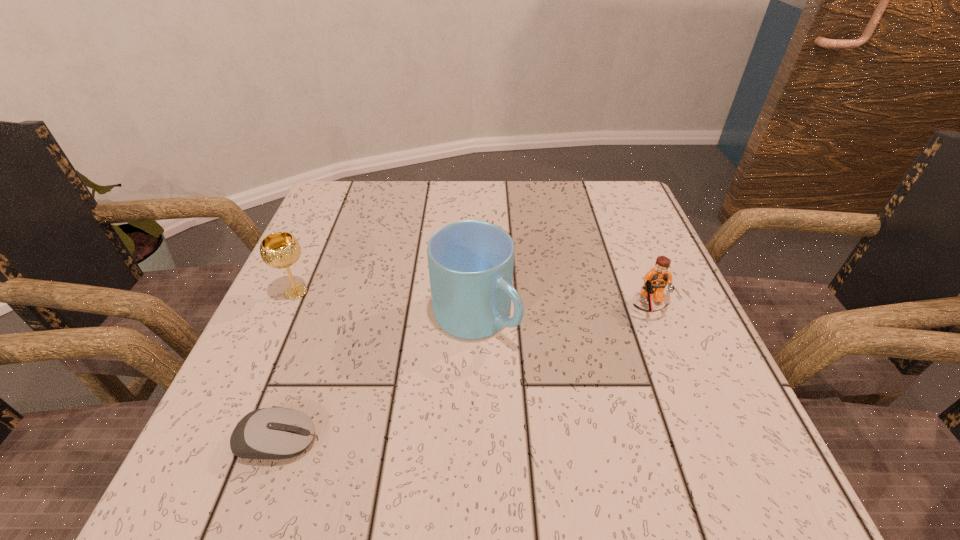
Identify the location of free space that is in between the nearest object and the mug. (375, 379).

What are the coordinates of `object that is the third closest to the second object from right to left` in the screenshot? It's located at (279, 250).

Where is `the second closest object to the second object from right to left`? The height and width of the screenshot is (540, 960). the second closest object to the second object from right to left is located at coordinates (655, 281).

Find the location of a particular element. blank space that satisfies the following two spatial constraints: 1. on the front side of the second object from right to left; 2. on the wheel side of the computer equipment is located at coordinates (474, 441).